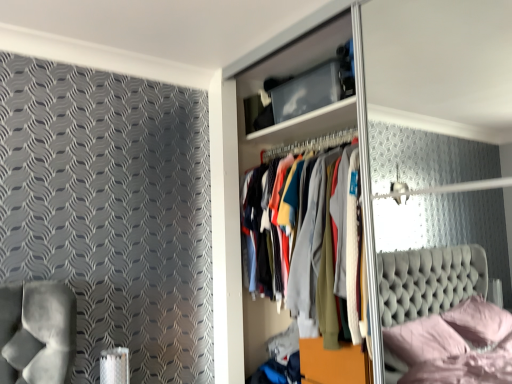
Question: Looking at their shapes, would you say transparent plastic glass door at center is wider or thinner than wooden dresser at center?

Choices:
 (A) thin
 (B) wide

Answer: (B)

Question: In the image, is transparent plastic glass door at center on the left side or the right side of wooden dresser at center?

Choices:
 (A) right
 (B) left

Answer: (A)

Question: From a real-world perspective, is transparent plastic glass door at center physically located above or below wooden dresser at center?

Choices:
 (A) above
 (B) below

Answer: (B)

Question: In terms of width, does wooden dresser at center look wider or thinner when compared to transparent plastic glass door at center?

Choices:
 (A) thin
 (B) wide

Answer: (A)

Question: Is wooden dresser at center taller or shorter than transparent plastic glass door at center?

Choices:
 (A) short
 (B) tall

Answer: (A)

Question: Relative to transparent plastic glass door at center, is wooden dresser at center in front or behind?

Choices:
 (A) behind
 (B) front

Answer: (A)

Question: From the image's perspective, is wooden dresser at center positioned above or below transparent plastic glass door at center?

Choices:
 (A) above
 (B) below

Answer: (A)